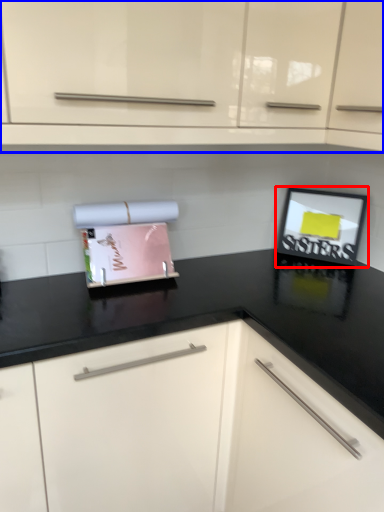
Question: Which object appears closest to the camera in this image, picture frame (highlighted by a red box) or cabinetry (highlighted by a blue box)?

Choices:
 (A) picture frame
 (B) cabinetry

Answer: (B)